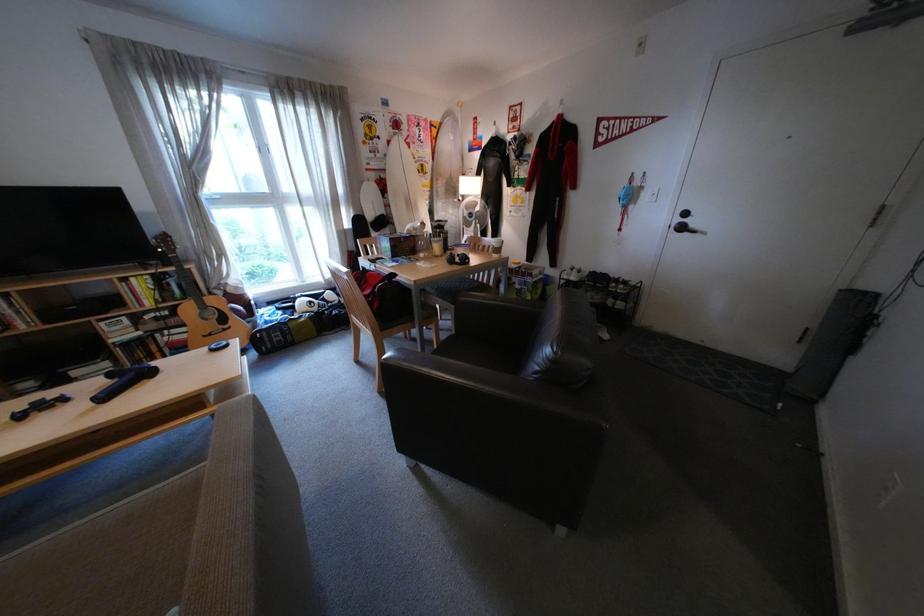
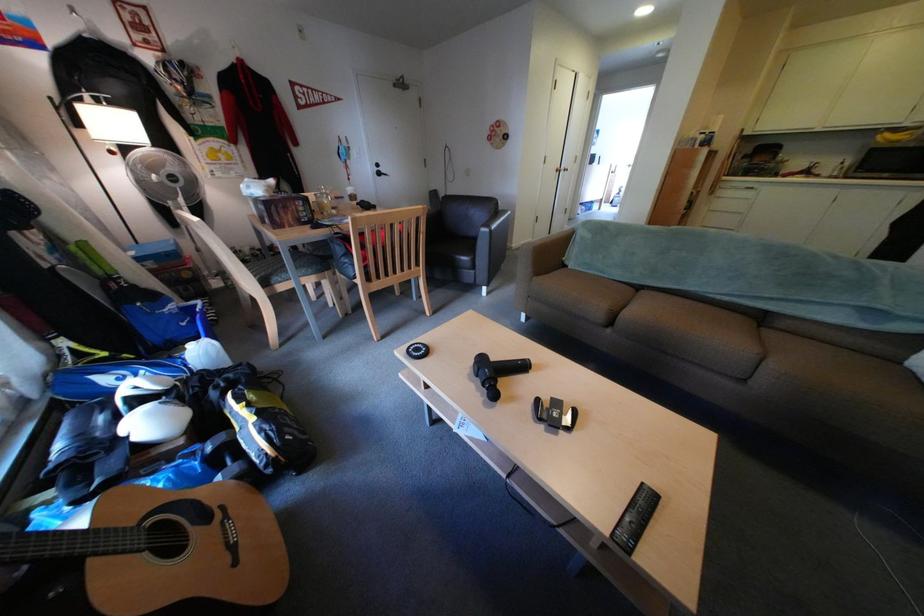
Find the pixel in the second image that matches point (223, 306) in the first image.

(148, 527)